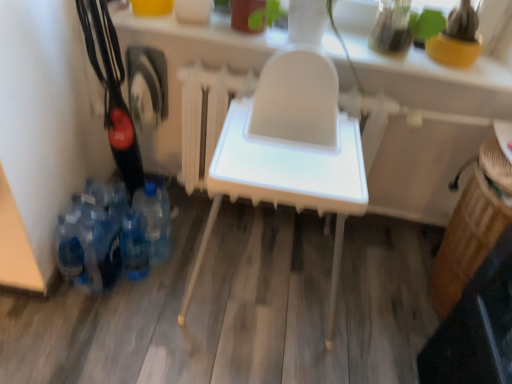
Question: Is white plastic highchair at center in front of blue translucent bottle at lower left, the second bottle when ordered from right to left?

Choices:
 (A) yes
 (B) no

Answer: (B)

Question: Is white plastic highchair at center taller than blue translucent bottle at lower left, the second bottle in the left-to-right sequence?

Choices:
 (A) no
 (B) yes

Answer: (B)

Question: From the image's perspective, is white plastic highchair at center below blue translucent bottle at lower left, the second bottle in the left-to-right sequence?

Choices:
 (A) yes
 (B) no

Answer: (B)

Question: Is white plastic highchair at center further to the viewer compared to blue translucent bottle at lower left, the second bottle in the left-to-right sequence?

Choices:
 (A) yes
 (B) no

Answer: (A)

Question: Does white plastic highchair at center appear on the left side of blue translucent bottle at lower left, the second bottle in the left-to-right sequence?

Choices:
 (A) no
 (B) yes

Answer: (A)

Question: Looking at the image, does blue translucent bottle at lower left, the second bottle when ordered from right to left, seem bigger or smaller compared to blue plastic bottle at lower left, marked as the 3th bottle in a left-to-right arrangement?

Choices:
 (A) big
 (B) small

Answer: (B)

Question: In the image, is blue translucent bottle at lower left, the second bottle when ordered from right to left, positioned in front of or behind blue plastic bottle at lower left, arranged as the first bottle when viewed from the right?

Choices:
 (A) front
 (B) behind

Answer: (A)

Question: In terms of width, does blue translucent bottle at lower left, the second bottle in the left-to-right sequence, look wider or thinner when compared to blue plastic bottle at lower left, marked as the 3th bottle in a left-to-right arrangement?

Choices:
 (A) wide
 (B) thin

Answer: (B)

Question: In the image, is blue translucent bottle at lower left, the second bottle in the left-to-right sequence, on the left side or the right side of blue plastic bottle at lower left, marked as the 3th bottle in a left-to-right arrangement?

Choices:
 (A) left
 (B) right

Answer: (A)

Question: In terms of size, does blue translucent bottle at lower left, the second bottle when ordered from right to left, appear bigger or smaller than white plastic high chair at center?

Choices:
 (A) big
 (B) small

Answer: (B)

Question: In the image, is blue translucent bottle at lower left, the second bottle when ordered from right to left, on the left side or the right side of white plastic high chair at center?

Choices:
 (A) left
 (B) right

Answer: (A)

Question: Is blue translucent bottle at lower left, the second bottle in the left-to-right sequence, inside the boundaries of white plastic high chair at center, or outside?

Choices:
 (A) inside
 (B) outside

Answer: (B)

Question: Is blue translucent bottle at lower left, the second bottle in the left-to-right sequence, in front of or behind white plastic high chair at center in the image?

Choices:
 (A) behind
 (B) front

Answer: (A)

Question: Is white plastic highchair at center inside the boundaries of blue translucent bottle at lower left, the second bottle in the left-to-right sequence, or outside?

Choices:
 (A) inside
 (B) outside

Answer: (B)

Question: From a real-world perspective, relative to blue translucent bottle at lower left, the second bottle in the left-to-right sequence, is white plastic highchair at center vertically above or below?

Choices:
 (A) above
 (B) below

Answer: (A)